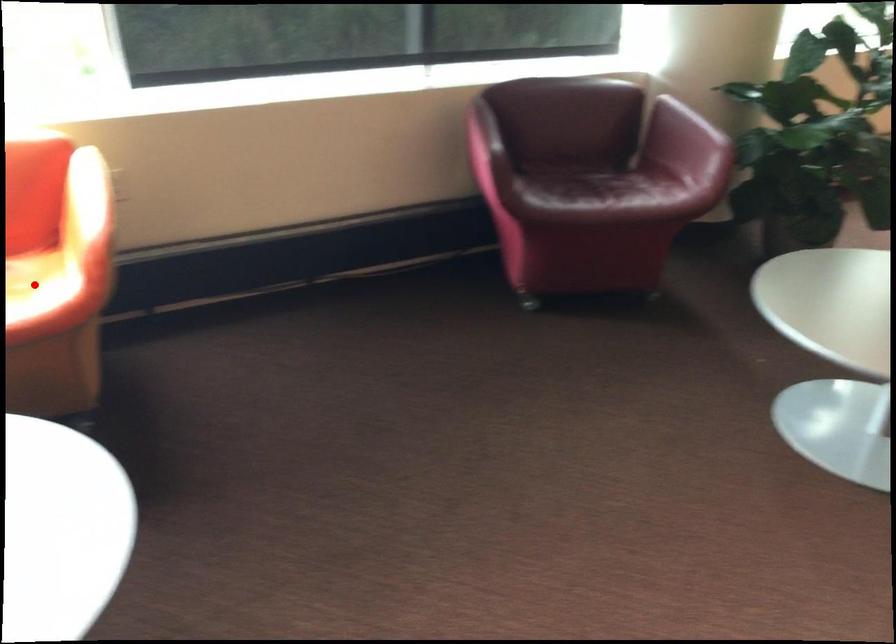
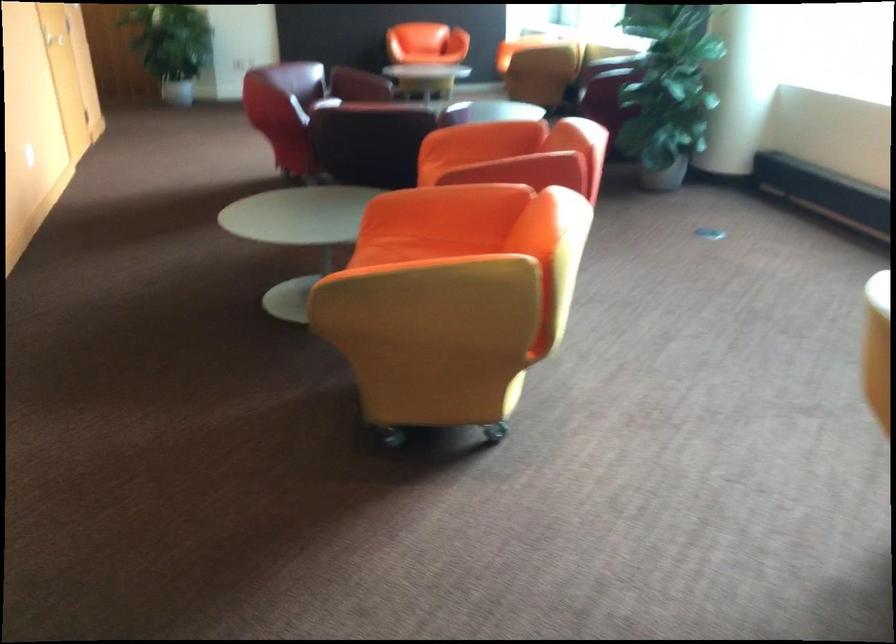
Question: I am providing you with two images of the same scene from different viewpoints. A red point is marked on the first image. Is the red point's position out of view in image 2?

Choices:
 (A) Yes
 (B) No

Answer: (A)